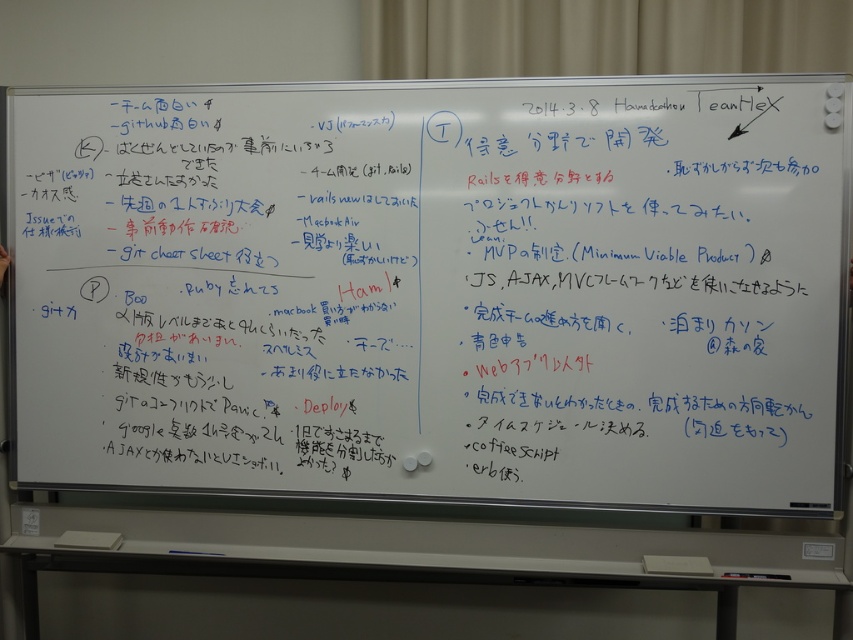
Does white paper at bottom have a lesser height compared to white paper at lower center?

Yes, white paper at bottom is shorter than white paper at lower center.

Does point (646, 564) lie in front of point (88, 547)?

Yes, it is.

I want to click on white paper at bottom, so click(x=676, y=564).

Does whiteboard at center come in front of white paper at bottom?

Yes, whiteboard at center is closer to the viewer.

Can you confirm if whiteboard at center is positioned below white paper at bottom?

No, whiteboard at center is not below white paper at bottom.

Find the location of `whiteboard at center`. whiteboard at center is located at coordinates (434, 289).

Does point (722, 145) come behind point (65, 532)?

No, (722, 145) is in front of (65, 532).

Between whiteboard at center and white paper at lower center, which one is positioned higher?

whiteboard at center is above.

At what (x,y) coordinates should I click in order to perform the action: click on whiteboard at center. Please return your answer as a coordinate pair (x, y). The image size is (853, 640). Looking at the image, I should click on (434, 289).